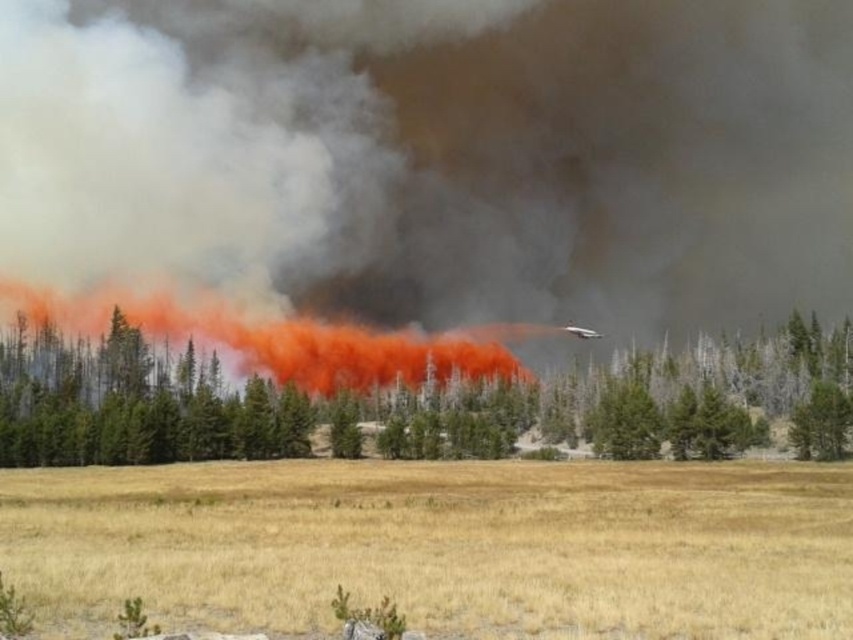
Which is in front, point (831, 454) or point (434, 369)?

Point (831, 454) is in front.

Describe the element at coordinates (666, 397) in the screenshot. I see `green matte tree at center` at that location.

This screenshot has width=853, height=640. Identify the location of green matte tree at center. (666, 397).

In the scene shown: Is dry grass at lower center to the left of orange smoke at center from the viewer's perspective?

Incorrect, dry grass at lower center is not on the left side of orange smoke at center.

Between point (672, 602) and point (97, 314), which one is positioned in front?

Point (672, 602) is in front.

Locate an element on the screen. The image size is (853, 640). dry grass at lower center is located at coordinates (440, 547).

Can you confirm if dry grass at lower center is smaller than green matte tree at center?

Indeed, dry grass at lower center has a smaller size compared to green matte tree at center.

Between dry grass at lower center and green matte tree at center, which one is positioned lower?

Positioned lower is dry grass at lower center.

Who is more forward, (x=68, y=500) or (x=688, y=433)?

Point (x=68, y=500) is more forward.

Identify the location of dry grass at lower center. This screenshot has width=853, height=640. [x=440, y=547].